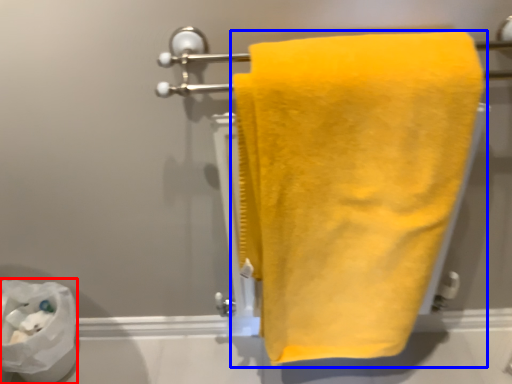
Question: Which of the following is the closest to the observer, toilet paper (highlighted by a red box) or towel (highlighted by a blue box)?

Choices:
 (A) toilet paper
 (B) towel

Answer: (B)